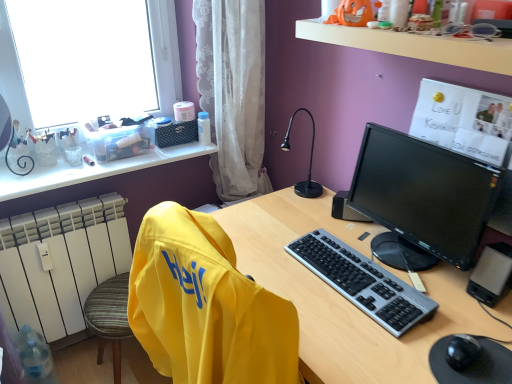
I want to click on free point below black glossy monitor at center right (from a real-world perspective), so click(x=399, y=249).